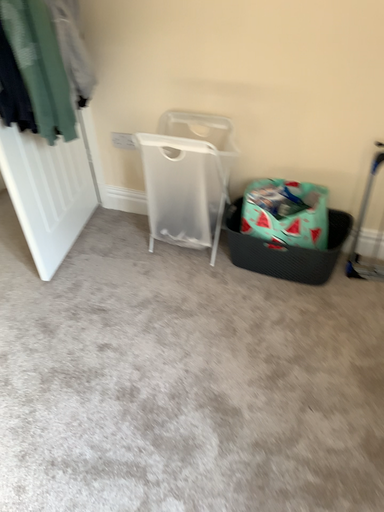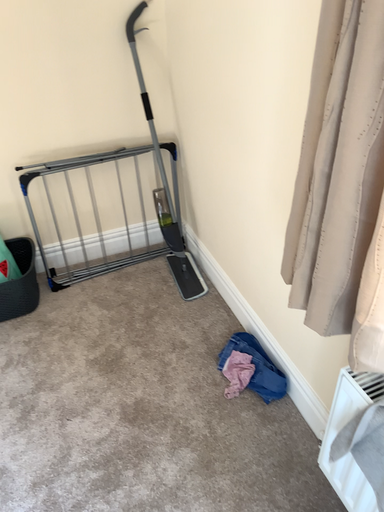
Question: How did the camera likely rotate when shooting the video?

Choices:
 (A) rotated left
 (B) rotated right

Answer: (B)